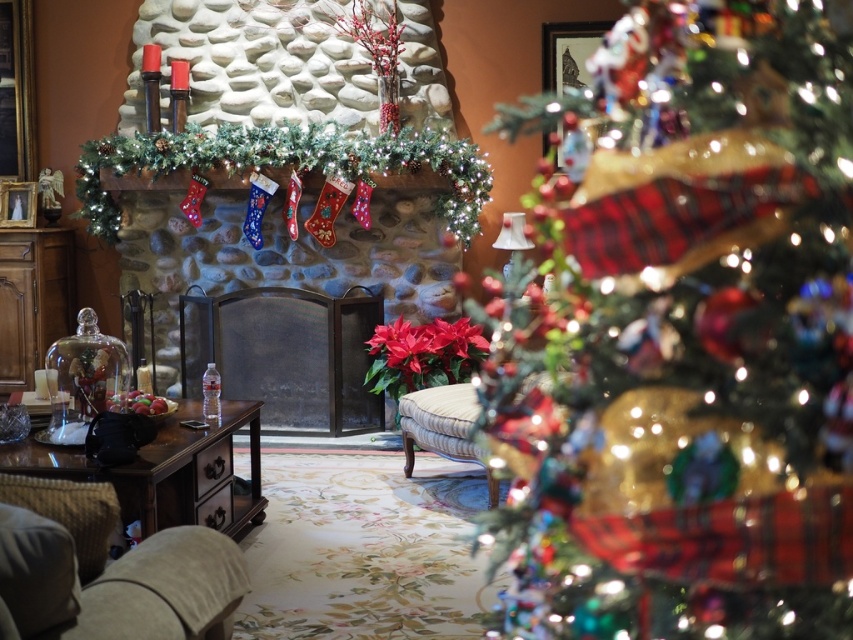
You are standing in the living room and want to place a 6 meter long Christmas decoration on the floor. Can you fit it between the metallic fireplace screen at center and the nearest wall?

The metallic fireplace screen at center is 5.64 meters away from the viewer. Since the decoration is 6 meters long, it would not fit between the metallic fireplace screen at center and the nearest wall as the distance is shorter than the decoration length.

You are standing at the entrance of the living room and want to sit down in the beige fabric armchair at lower left. Based on the coordinates provided, in which direction should you move relative to your current position?

The beige fabric armchair at lower left is located at coordinates point (114, 582), which means you should move to the lower left direction from your current position at the entrance.

You are sitting in the beige fabric armchair at lower left and want to reach the red matte poinsettia at center to adjust its position. Can you do this without getting up from the chair?

The distance between the beige fabric armchair at lower left and the red matte poinsettia at center is 3.50 meters. Since this distance is too far to reach while sitting, you would need to get up to adjust the poinsettia.